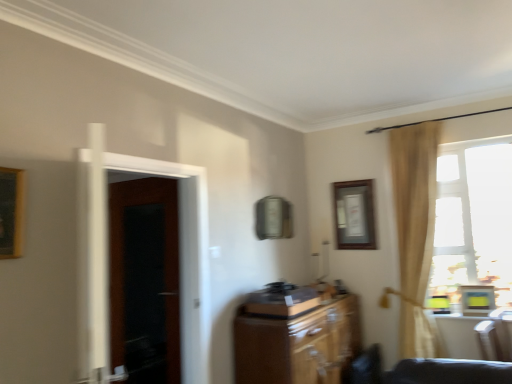
Describe the element at coordinates (473, 218) in the screenshot. I see `transparent glass window at right` at that location.

Measure the distance between wooden record player at center and camera.

wooden record player at center and camera are 9.70 feet apart from each other.

Locate an element on the screen. This screenshot has height=384, width=512. dark wood screen door at left is located at coordinates (106, 256).

Locate an element on the screen. The width and height of the screenshot is (512, 384). wooden picture frame at upper center is located at coordinates (354, 215).

Image resolution: width=512 pixels, height=384 pixels. What are the coordinates of `transparent glass window at right` in the screenshot? It's located at (473, 218).

Is dark wood screen door at left to the left or to the right of dark wood door at left in the image?

Based on their positions, dark wood screen door at left is located to the right of dark wood door at left.

Does dark wood screen door at left have a smaller size compared to dark wood door at left?

Incorrect, dark wood screen door at left is not smaller in size than dark wood door at left.

From a real-world perspective, is dark wood screen door at left physically below dark wood door at left?

No, from a real-world perspective, dark wood screen door at left is not under dark wood door at left.

Can you confirm if dark wood screen door at left is wider than dark wood door at left?

Indeed, dark wood screen door at left has a greater width compared to dark wood door at left.

From the image's perspective, would you say wooden cabinet at center is positioned over dark wood door at left?

No, from the image's perspective, wooden cabinet at center is not over dark wood door at left.

Visually, is wooden cabinet at center positioned to the left or to the right of dark wood door at left?

wooden cabinet at center is to the right of dark wood door at left.

Considering the relative sizes of wooden cabinet at center and dark wood door at left in the image provided, is wooden cabinet at center smaller than dark wood door at left?

No.

Based on their sizes in the image, would you say dark wood screen door at left is bigger or smaller than wooden record player at center?

Considering their sizes, dark wood screen door at left takes up more space than wooden record player at center.

Locate an element on the screen. The width and height of the screenshot is (512, 384). screen door above the wooden record player at center (from a real-world perspective) is located at coordinates (106, 256).

Would you say dark wood screen door at left is a long distance from wooden record player at center?

No, dark wood screen door at left is in close proximity to wooden record player at center.

From a real-world perspective, is dark wood screen door at left physically above wooden record player at center?

Indeed, from a real-world perspective, dark wood screen door at left stands above wooden record player at center.

Is transparent glass window at right inside or outside of wooden record player at center?

transparent glass window at right is not inside wooden record player at center, it's outside.

Does transparent glass window at right appear on the right side of wooden record player at center?

Correct, you'll find transparent glass window at right to the right of wooden record player at center.

Is point (459, 297) behind point (310, 294)?

That is True.

Is dark wood screen door at left bigger than transparent glass window at right?

Yes, dark wood screen door at left is bigger than transparent glass window at right.

Is dark wood screen door at left situated inside transparent glass window at right or outside?

dark wood screen door at left exists outside the volume of transparent glass window at right.

Can you confirm if dark wood screen door at left is positioned to the right of transparent glass window at right?

Incorrect, dark wood screen door at left is not on the right side of transparent glass window at right.

Between dark wood screen door at left and transparent glass window at right, which one has less height?

With less height is dark wood screen door at left.

Does dark wood door at left have a smaller size compared to transparent glass window at right?

Indeed, dark wood door at left has a smaller size compared to transparent glass window at right.

Is dark wood door at left not close to transparent glass window at right?

Yes, dark wood door at left is far from transparent glass window at right.

Is dark wood door at left turned away from transparent glass window at right?

dark wood door at left does not have its back to transparent glass window at right.

Is dark wood door at left not inside transparent glass window at right?

Yes.

In terms of height, does transparent glass window at right look taller or shorter compared to dark wood screen door at left?

Clearly, transparent glass window at right is taller compared to dark wood screen door at left.

Is transparent glass window at right turned away from dark wood screen door at left?

No, transparent glass window at right is not facing the opposite direction of dark wood screen door at left.

Which of these two, transparent glass window at right or dark wood screen door at left, is wider?

dark wood screen door at left.

From a real-world perspective, is transparent glass window at right under dark wood screen door at left?

Actually, transparent glass window at right is physically above dark wood screen door at left in the real world.

Locate an element on the screen. This screenshot has height=384, width=512. door that appears below the dark wood screen door at left (from a real-world perspective) is located at coordinates (145, 280).

At what (x,y) coordinates should I click in order to perform the action: click on door that is on the left side of wooden cabinet at center. Please return your answer as a coordinate pair (x, y). The image size is (512, 384). Looking at the image, I should click on (145, 280).

Considering their positions, is dark wood door at left positioned closer to dark wood screen door at left than wooden cabinet at center?

wooden cabinet at center is closer to dark wood screen door at left.

Which object lies further to the anchor point transparent glass window at right, wooden cabinet at center or dark wood screen door at left?

dark wood screen door at left is positioned further to the anchor transparent glass window at right.

Considering their positions, is dark wood screen door at left positioned further to transparent glass window at right than wooden cabinet at center?

Based on the image, dark wood screen door at left appears to be further to transparent glass window at right.

Looking at the image, which one is located closer to wooden record player at center, transparent glass window at right or dark wood screen door at left?

dark wood screen door at left is closer to wooden record player at center.

When comparing their distances from wooden cabinet at center, does dark wood door at left or wooden picture frame at upper center seem closer?

wooden picture frame at upper center.

Estimate the real-world distances between objects in this image. Which object is further from wooden picture frame at upper center, wooden record player at center or transparent glass window at right?

wooden record player at center.

Considering their positions, is transparent glass window at right positioned closer to wooden picture frame at upper center than wooden cabinet at center?

Based on the image, transparent glass window at right appears to be nearer to wooden picture frame at upper center.

Based on their spatial positions, is wooden record player at center or wooden cabinet at center further from dark wood screen door at left?

wooden cabinet at center.

Find the location of a particular element. This screenshot has width=512, height=384. cabinetry situated between dark wood door at left and wooden picture frame at upper center from left to right is located at coordinates (297, 344).

The image size is (512, 384). Find the location of `picture frame between dark wood screen door at left and transparent glass window at right from left to right`. picture frame between dark wood screen door at left and transparent glass window at right from left to right is located at coordinates (354, 215).

The image size is (512, 384). I want to click on picture frame situated between wooden record player at center and transparent glass window at right from left to right, so click(x=354, y=215).

The height and width of the screenshot is (384, 512). In order to click on appliance located between dark wood door at left and wooden picture frame at upper center in the left-right direction in this screenshot , I will do `click(281, 301)`.